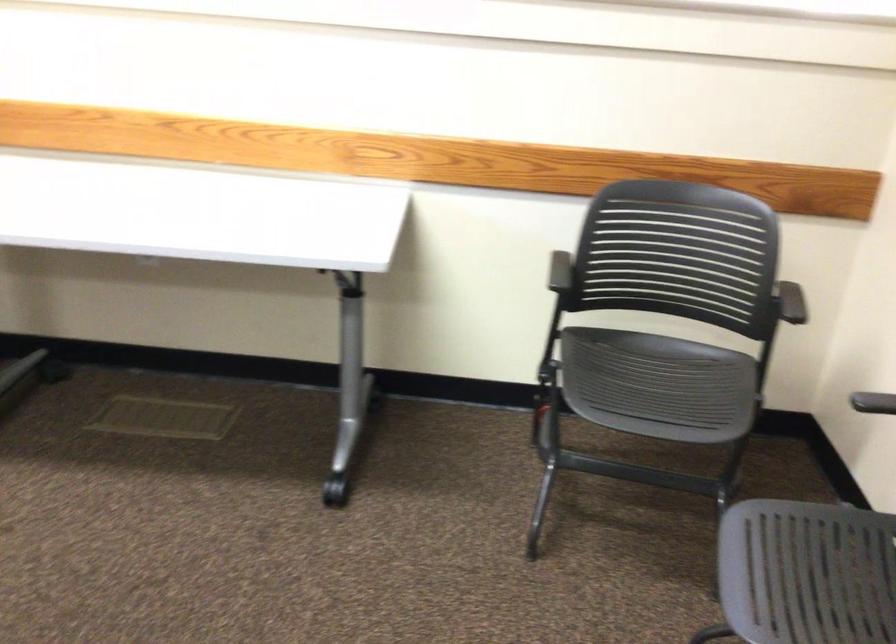
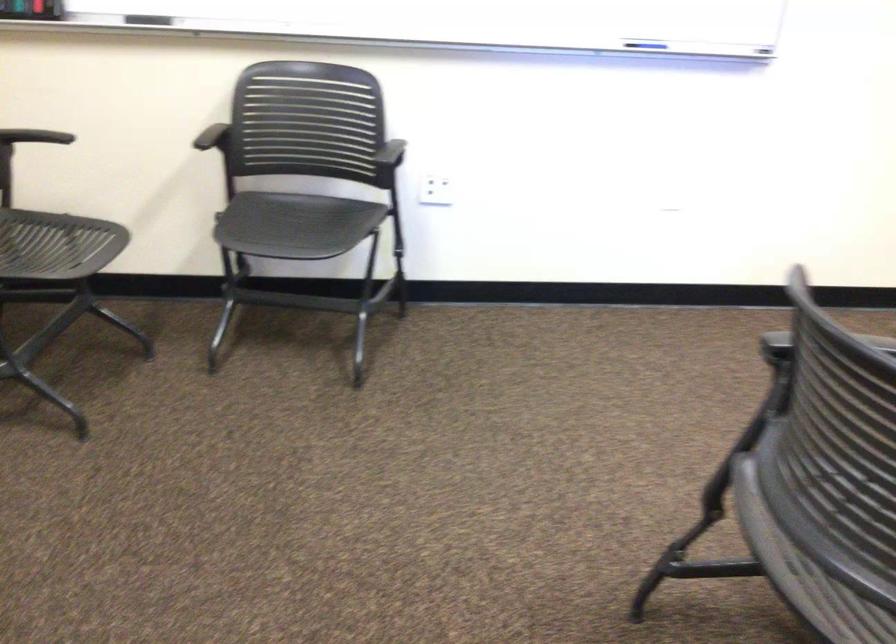
Where in the second image is the point corresponding to (650,397) from the first image?

(56, 245)